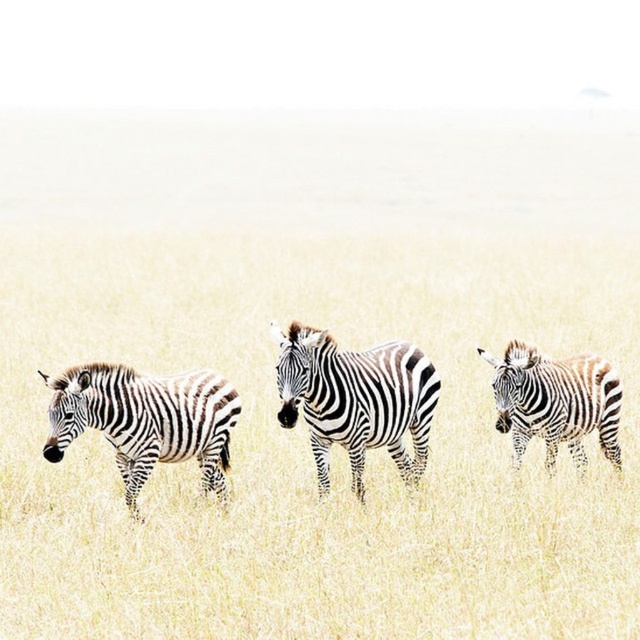
Does white grassland at center have a lesser height compared to black and white striped zebra at left?

In fact, white grassland at center may be taller than black and white striped zebra at left.

Which of these two, white grassland at center or black and white striped zebra at left, stands taller?

With more height is white grassland at center.

You are a GUI agent. You are given a task and a screenshot of the screen. Output one action in this format:
    pyautogui.click(x=<x>, y=<y>)
    Task: Click on the white grassland at center
    
    Given the screenshot: What is the action you would take?
    pyautogui.click(x=308, y=448)

At what (x,y) coordinates should I click in order to perform the action: click on white grassland at center. Please return your answer as a coordinate pair (x, y). This screenshot has width=640, height=640. Looking at the image, I should click on (308, 448).

Is black and white striped zebras at center to the left of black and white striped zebra at center from the viewer's perspective?

No, black and white striped zebras at center is not to the left of black and white striped zebra at center.

Is black and white striped zebras at center closer to the viewer compared to black and white striped zebra at center?

No, it is not.

Which is behind, point (52, 435) or point (310, 448)?

Positioned behind is point (310, 448).

Find the location of `black and white striped zebras at center`. black and white striped zebras at center is located at coordinates (356, 400).

Does point (122, 385) come closer to viewer compared to point (612, 460)?

Yes, point (122, 385) is closer to viewer.

Can you confirm if black and white striped zebra at left is shorter than black and white striped zebra at right?

Incorrect, black and white striped zebra at left's height does not fall short of black and white striped zebra at right's.

At what (x,y) coordinates should I click in order to perform the action: click on black and white striped zebra at left. Please return your answer as a coordinate pair (x, y). The height and width of the screenshot is (640, 640). Looking at the image, I should click on (145, 419).